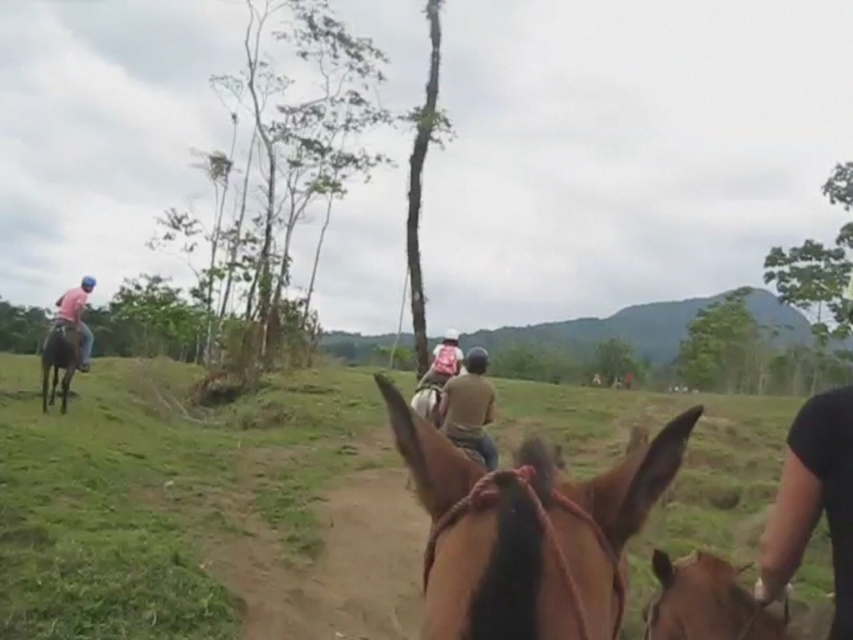
You are a photographer positioned at the origin point of the coordinate system. You want to take a photo of the brown glossy horse at center. What are the coordinates where you should aim your camera?

The coordinates to aim the camera are at point (527, 531).

You are a photographer positioned on the dirt path and want to take a photo of both the brown leather horse at left and the brown leather saddle at center. Which object should you focus on first to ensure it appears sharp in the photo?

You should focus on the brown leather horse at left first because it is closer to you than the brown leather saddle at center, so focusing on it will keep it sharp while the saddle may appear slightly blurred. Alternatively, adjust your focus point between them for both to be in focus.